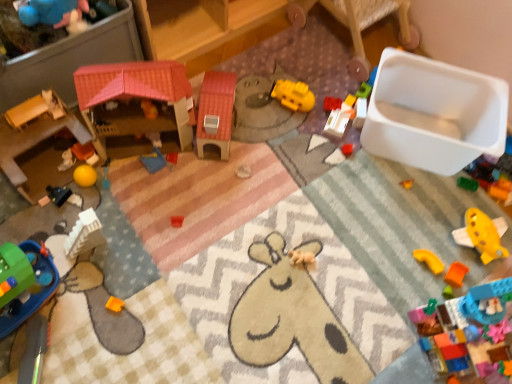
Question: Does blue plastic tray at center, which ranks as the 10th toy in right-to-left order, touch orange matte block at lower right, which ranks as the second toy in right-to-left order?

Choices:
 (A) yes
 (B) no

Answer: (B)

Question: Are blue plastic tray at center, which ranks as the 10th toy in right-to-left order, and orange matte block at lower right, acting as the 14th toy starting from the left, far apart?

Choices:
 (A) no
 (B) yes

Answer: (B)

Question: Would you say blue plastic tray at center, acting as the 6th toy starting from the left, contains orange matte block at lower right, acting as the 14th toy starting from the left?

Choices:
 (A) yes
 (B) no

Answer: (B)

Question: Considering the relative sizes of blue plastic tray at center, acting as the 6th toy starting from the left, and orange matte block at lower right, acting as the 14th toy starting from the left, in the image provided, is blue plastic tray at center, acting as the 6th toy starting from the left, smaller than orange matte block at lower right, acting as the 14th toy starting from the left,?

Choices:
 (A) yes
 (B) no

Answer: (B)

Question: Is blue plastic tray at center, which ranks as the 10th toy in right-to-left order, to the right of orange matte block at lower right, which ranks as the second toy in right-to-left order, from the viewer's perspective?

Choices:
 (A) yes
 (B) no

Answer: (B)

Question: Considering the relative sizes of blue plastic tray at center, acting as the 6th toy starting from the left, and orange matte block at lower right, acting as the 14th toy starting from the left, in the image provided, is blue plastic tray at center, acting as the 6th toy starting from the left, shorter than orange matte block at lower right, acting as the 14th toy starting from the left,?

Choices:
 (A) yes
 (B) no

Answer: (B)

Question: Is yellow plastic block at upper center, which appears as the 11th toy when viewed from the left, oriented towards white plastic container at upper right, which ranks as the 2th furniture in left-to-right order?

Choices:
 (A) yes
 (B) no

Answer: (B)

Question: Is the position of yellow plastic block at upper center, the fifth toy from the right, less distant than that of white plastic container at upper right, which ranks as the 2th furniture in left-to-right order?

Choices:
 (A) no
 (B) yes

Answer: (A)

Question: Does yellow plastic block at upper center, which appears as the 11th toy when viewed from the left, appear on the right side of white plastic container at upper right, the 1th furniture when ordered from right to left?

Choices:
 (A) yes
 (B) no

Answer: (B)

Question: Is yellow plastic block at upper center, the fifth toy from the right, beside white plastic container at upper right, the 1th furniture when ordered from right to left?

Choices:
 (A) yes
 (B) no

Answer: (B)

Question: Is yellow plastic block at upper center, the fifth toy from the right, taller than white plastic container at upper right, which ranks as the 2th furniture in left-to-right order?

Choices:
 (A) yes
 (B) no

Answer: (B)

Question: Does yellow plastic block at upper center, the fifth toy from the right, lie behind white plastic container at upper right, which ranks as the 2th furniture in left-to-right order?

Choices:
 (A) no
 (B) yes

Answer: (B)

Question: Is green plastic toy at lower left, the fourteenth toy viewed from the right, further to camera compared to smooth wooden dollhouse at left, the 1th toy in the left-to-right sequence?

Choices:
 (A) yes
 (B) no

Answer: (B)